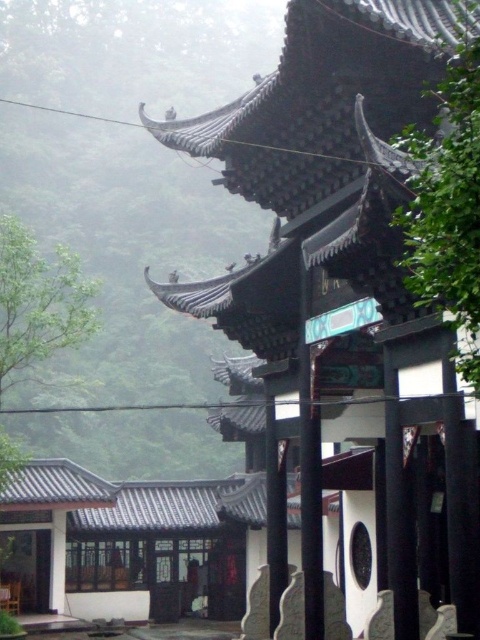
Does black tile roof at center appear on the right side of foggy translucent at left?

Yes, black tile roof at center is to the right of foggy translucent at left.

Does black tile roof at center lie in front of foggy translucent at left?

Yes, black tile roof at center is in front of foggy translucent at left.

Who is more distant from viewer, (x=385, y=192) or (x=50, y=118)?

Point (x=50, y=118)

Image resolution: width=480 pixels, height=640 pixels. What are the coordinates of `black tile roof at center` in the screenshot? It's located at (345, 301).